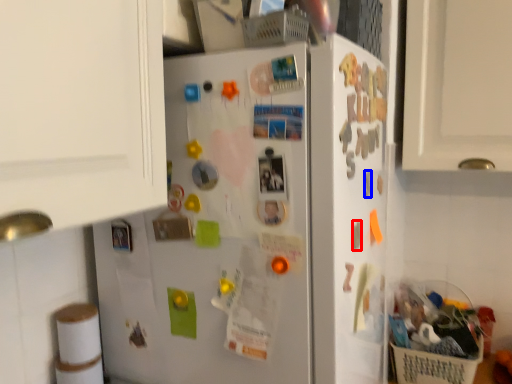
Question: Which object appears closest to the camera in this image, magnet (highlighted by a red box) or magnet (highlighted by a blue box)?

Choices:
 (A) magnet
 (B) magnet

Answer: (A)